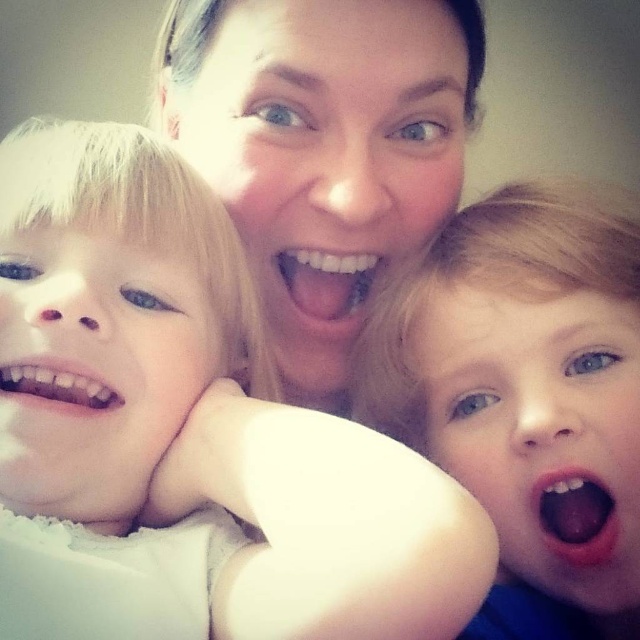
Does smooth skin face at center appear under pink glossy lips at center?

Actually, smooth skin face at center is above pink glossy lips at center.

Which is more to the right, smooth skin face at center or pink glossy lips at center?

pink glossy lips at center

Between point (376, 17) and point (573, 541), which one is positioned behind?

Positioned behind is point (376, 17).

Locate an element on the screen. The height and width of the screenshot is (640, 640). smooth skin face at center is located at coordinates (323, 147).

Who is more forward, (612, 234) or (573, 520)?

Point (573, 520) is in front.

Does blonde hair at right come behind pink glossy lips at center?

That is False.

Find the location of a particular element. This screenshot has height=640, width=640. blonde hair at right is located at coordinates (525, 397).

At what (x,y) coordinates should I click in order to perform the action: click on smooth skin face at center. Please return your answer as a coordinate pair (x, y). This screenshot has height=640, width=640. Looking at the image, I should click on coord(323,147).

Does smooth skin face at center appear on the left side of white glossy teeth at lower left?

In fact, smooth skin face at center is to the right of white glossy teeth at lower left.

Which is in front, point (205, 40) or point (20, 372)?

Point (20, 372)

In order to click on smooth skin face at center in this screenshot , I will do `click(323, 147)`.